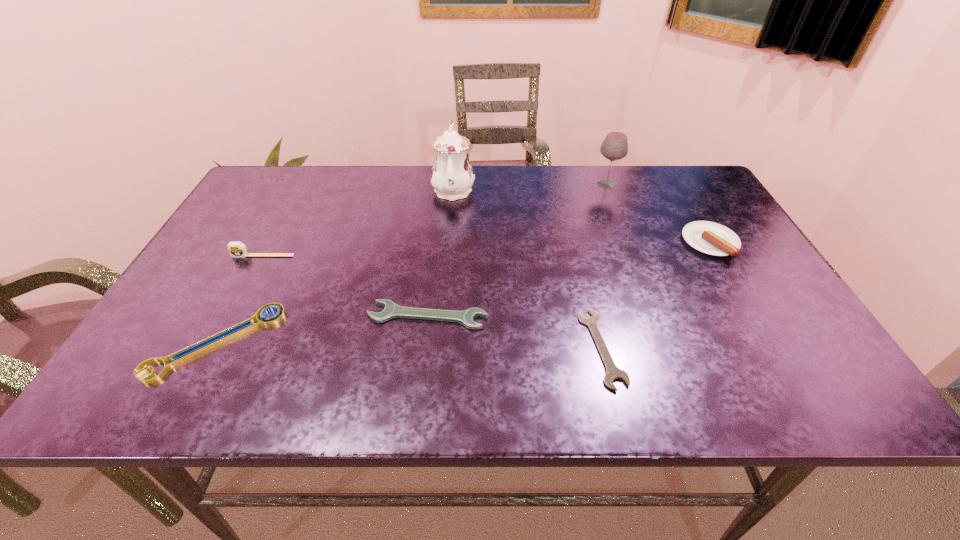
Identify the location of vacant area that lies between the second wrench from right to left and the tape measure. This screenshot has height=540, width=960. (346, 286).

The height and width of the screenshot is (540, 960). I want to click on empty space that is in between the tape measure and the shortest wrench, so click(433, 302).

At what (x,y) coordinates should I click in order to perform the action: click on free point between the tape measure and the rightmost object. Please return your answer as a coordinate pair (x, y). This screenshot has height=540, width=960. Looking at the image, I should click on tap(487, 249).

Identify the location of unoccupied area between the rightmost object and the fifth object from left to right. The height and width of the screenshot is (540, 960). (656, 295).

Locate an element on the screen. The height and width of the screenshot is (540, 960). blank region between the second wrench from right to left and the tape measure is located at coordinates (346, 286).

You are a GUI agent. You are given a task and a screenshot of the screen. Output one action in this format:
    pyautogui.click(x=<x>, y=<y>)
    Task: Click on the object that is the sixth closest to the second tallest object
    
    Given the screenshot: What is the action you would take?
    pyautogui.click(x=228, y=334)

Identify which object is located as the third nearest to the leftmost wrench. Please provide its 2D coordinates. Your answer should be formatted as a tuple, i.e. [(x, y)], where the tuple contains the x and y coordinates of a point satisfying the conditions above.

[(452, 176)]

Where is `wrench that is the closest one to the sausage`? The width and height of the screenshot is (960, 540). wrench that is the closest one to the sausage is located at coordinates (613, 372).

This screenshot has height=540, width=960. Find the location of `wrench that is the second closest one to the leftmost wrench`. wrench that is the second closest one to the leftmost wrench is located at coordinates (613, 372).

Locate an element on the screen. The width and height of the screenshot is (960, 540). free region that satisfies the following two spatial constraints: 1. at the front of the tape measure with the tape extended; 2. on the right side of the shortest wrench is located at coordinates (213, 348).